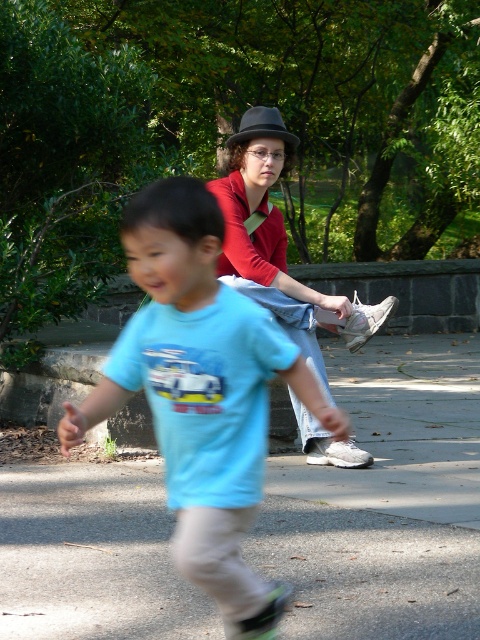
You are a delivery drone flying over the park. You need to land on the gray concrete pavement at center. However, there is a black felt hat at upper center in the way. Can you safely land on the pavement without hitting the hat?

The gray concrete pavement at center has a lesser height compared to black felt hat at upper center. Since the pavement is lower than the hat, the drone can safely land on the gray concrete pavement at center as it is below the hat and won